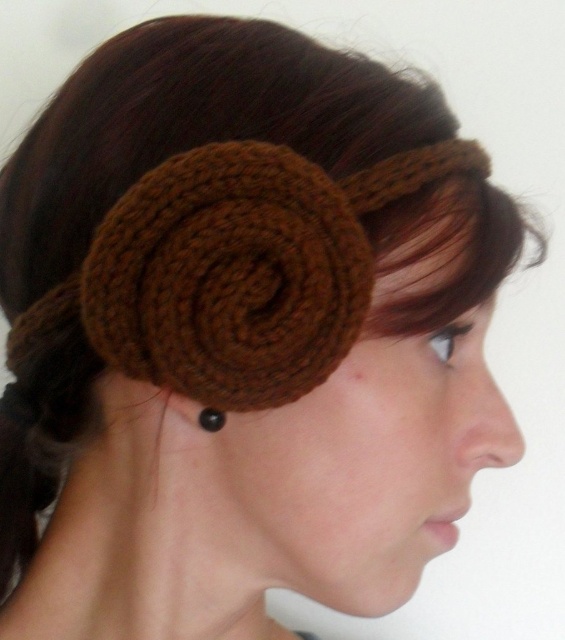
Question: Which of the following is the closest to the observer?

Choices:
 (A) (210, 424)
 (B) (249, 397)

Answer: (B)

Question: Is brown knitted hair accessory at center wider than black pearl earring at ear?

Choices:
 (A) no
 (B) yes

Answer: (B)

Question: Can you confirm if brown knitted hair accessory at center is positioned above black pearl earring at ear?

Choices:
 (A) no
 (B) yes

Answer: (B)

Question: Does brown knitted hair accessory at center appear under black pearl earring at ear?

Choices:
 (A) yes
 (B) no

Answer: (B)

Question: Which of the following is the closest to the observer?

Choices:
 (A) (220, 422)
 (B) (267, 168)

Answer: (B)